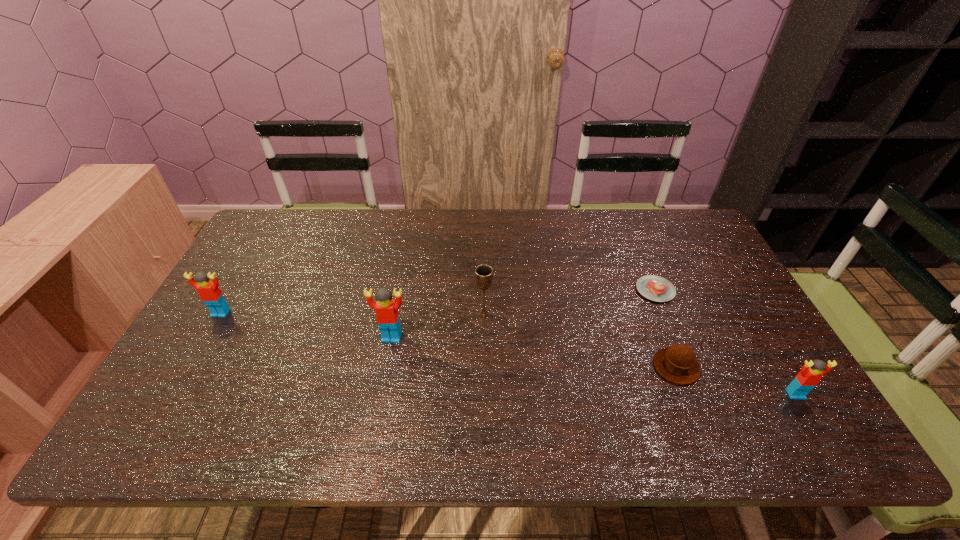
The width and height of the screenshot is (960, 540). Find the location of `object positioned at the near right corner`. object positioned at the near right corner is located at coordinates (811, 373).

The image size is (960, 540). In order to click on free spot at the far edge of the desktop in this screenshot , I will do `click(458, 224)`.

Where is `free space at the left edge`? Image resolution: width=960 pixels, height=540 pixels. free space at the left edge is located at coordinates (240, 271).

Where is `vacant region at the right edge of the desktop`? vacant region at the right edge of the desktop is located at coordinates (672, 262).

This screenshot has width=960, height=540. What are the coordinates of `free space at the near left corner of the desktop` in the screenshot? It's located at (158, 396).

Identify the location of free spot at the far right corner of the desktop. (652, 220).

You are a GUI agent. You are given a task and a screenshot of the screen. Output one action in this format:
    pyautogui.click(x=<x>, y=<y>)
    Task: Click on the unoccupied position between the nearest Lego and the farthest object
    
    Given the screenshot: What is the action you would take?
    pyautogui.click(x=726, y=342)

Find the location of `free point between the shortest object and the shortest Lego`. free point between the shortest object and the shortest Lego is located at coordinates (726, 342).

The width and height of the screenshot is (960, 540). What are the coordinates of `free spot between the second nearest Lego and the pastry` in the screenshot? It's located at (523, 314).

Find the location of a particular element. The image size is (960, 540). vacant area between the pastry and the leftmost Lego is located at coordinates (438, 301).